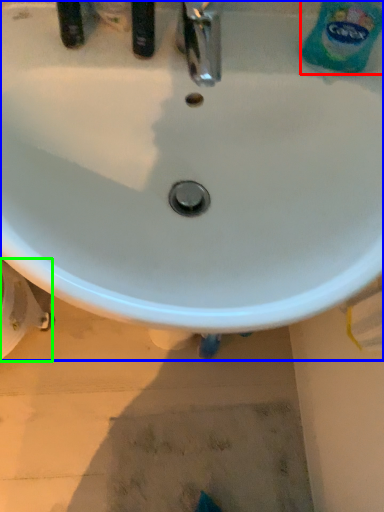
Question: Which object is positioned farthest from cleaning product (highlighted by a red box)? Select from sink (highlighted by a blue box) and bidet (highlighted by a green box).

Choices:
 (A) sink
 (B) bidet

Answer: (B)